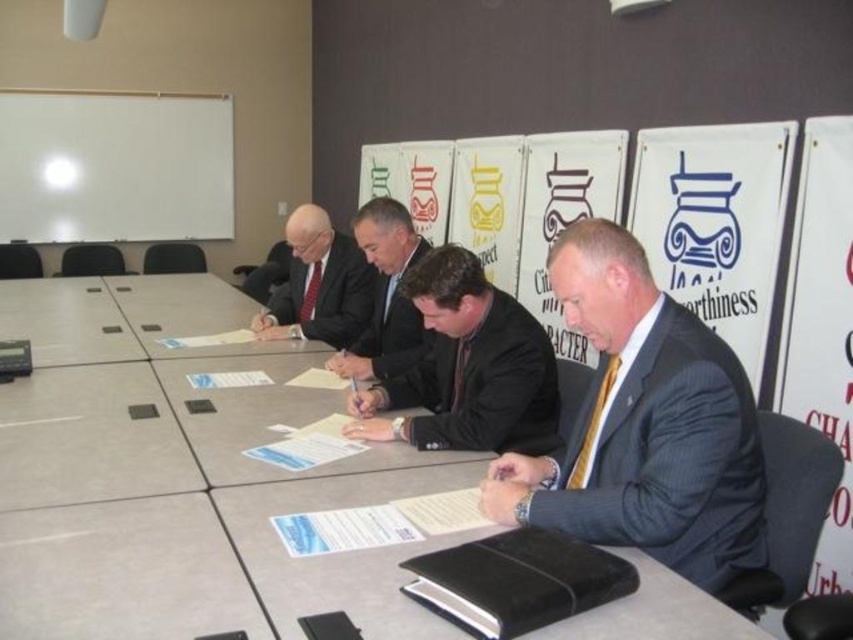
Consider the image. You are a participant in the meeting seated at the table. You need to pass a document to the person at point (30, 150) and then to point (56, 282). Which point should you go to first?

You should go to point (56, 282) first because point (30, 150) is behind it, so you can reach the person at point (56, 282) first before moving to the one behind.

You are organizing a small meeting and need to place a 1.2 meter wide laptop cart between the white matte board at upper left and the light gray laminate table at center. Can the laptop cart fit in the space between them?

The white matte board at upper left occupies less space than the light gray laminate table at center, so the space between them may be sufficient. However, without knowing the exact distance between the two objects, it is impossible to determine if the 1.2 meter wide laptop cart will fit.

You are a photographer trying to capture a closeup of the dark gray suit at center. However, the white matte board at upper left is blocking your view. Can you move the board to the side to get a clear shot?

The white matte board at upper left is larger in size than dark gray suit at center, so moving it might be necessary to avoid obstruction. However, since it is part of the scene, you should check if moving it is allowed before proceeding.